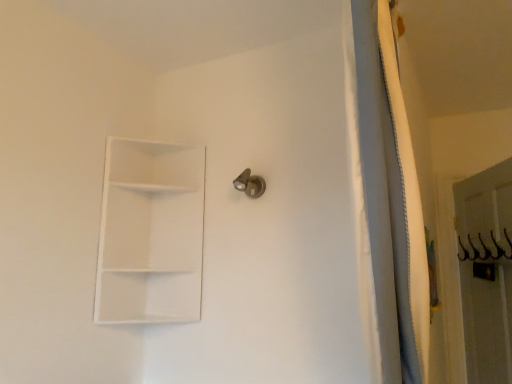
Locate an element on the screen. satin nickel door handle at upper center is located at coordinates (250, 184).

What do you see at coordinates (250, 184) in the screenshot? Image resolution: width=512 pixels, height=384 pixels. I see `satin nickel door handle at upper center` at bounding box center [250, 184].

The image size is (512, 384). I want to click on white matte shelf at upper left, so click(150, 233).

What do you see at coordinates (150, 233) in the screenshot?
I see `white matte shelf at upper left` at bounding box center [150, 233].

Locate an element on the screen. The image size is (512, 384). satin nickel door handle at upper center is located at coordinates (250, 184).

Is white matte shelf at upper left to the right of satin nickel door handle at upper center from the viewer's perspective?

Incorrect, white matte shelf at upper left is not on the right side of satin nickel door handle at upper center.

Is the position of white matte shelf at upper left more distant than that of satin nickel door handle at upper center?

No, the depth of white matte shelf at upper left is less than that of satin nickel door handle at upper center.

Does point (101, 235) lie in front of point (260, 183)?

Yes, it is in front of point (260, 183).

From the image's perspective, is white matte shelf at upper left located above or below satin nickel door handle at upper center?

white matte shelf at upper left is situated lower than satin nickel door handle at upper center in the image.

In the scene shown: From a real-world perspective, is white matte shelf at upper left positioned over satin nickel door handle at upper center based on gravity?

No, from a real-world perspective, white matte shelf at upper left is not over satin nickel door handle at upper center

Considering the sizes of objects white matte shelf at upper left and satin nickel door handle at upper center in the image provided, who is thinner, white matte shelf at upper left or satin nickel door handle at upper center?

satin nickel door handle at upper center.

From the picture: Can you confirm if white matte shelf at upper left is taller than satin nickel door handle at upper center?

Indeed, white matte shelf at upper left has a greater height compared to satin nickel door handle at upper center.

Does white matte shelf at upper left have a larger size compared to satin nickel door handle at upper center?

Indeed, white matte shelf at upper left has a larger size compared to satin nickel door handle at upper center.

Is satin nickel door handle at upper center a part of white matte shelf at upper left?

Actually, satin nickel door handle at upper center is outside white matte shelf at upper left.

In the scene shown: Is white matte shelf at upper left next to satin nickel door handle at upper center?

No, white matte shelf at upper left is not beside satin nickel door handle at upper center.

Is white matte shelf at upper left positioned with its back to satin nickel door handle at upper center?

That's not correct — white matte shelf at upper left is not looking away from satin nickel door handle at upper center.

How far apart are white matte shelf at upper left and satin nickel door handle at upper center?

A distance of 16.52 inches exists between white matte shelf at upper left and satin nickel door handle at upper center.

Identify the location of shelf lying below the satin nickel door handle at upper center (from the image's perspective). (150, 233).

Which is more to the left, satin nickel door handle at upper center or white matte shelf at upper left?

From the viewer's perspective, white matte shelf at upper left appears more on the left side.

Does satin nickel door handle at upper center come in front of white matte shelf at upper left?

No, satin nickel door handle at upper center is behind white matte shelf at upper left.

Based on the photo, which point is more distant from viewer, (234, 180) or (160, 191)?

The point (160, 191) is behind.

From the image's perspective, which one is positioned higher, satin nickel door handle at upper center or white matte shelf at upper left?

satin nickel door handle at upper center.

From a real-world perspective, which is physically below, satin nickel door handle at upper center or white matte shelf at upper left?

From a 3D spatial view, white matte shelf at upper left is below.

Considering the sizes of objects satin nickel door handle at upper center and white matte shelf at upper left in the image provided, who is thinner, satin nickel door handle at upper center or white matte shelf at upper left?

With smaller width is satin nickel door handle at upper center.

Which of these two, satin nickel door handle at upper center or white matte shelf at upper left, stands shorter?

Standing shorter between the two is satin nickel door handle at upper center.

Does satin nickel door handle at upper center have a larger size compared to white matte shelf at upper left?

No.

Is white matte shelf at upper left completely or partially inside satin nickel door handle at upper center?

No, white matte shelf at upper left is not surrounded by satin nickel door handle at upper center.

Is satin nickel door handle at upper center positioned far away from white matte shelf at upper left?

No, satin nickel door handle at upper center is not far from white matte shelf at upper left.

Is satin nickel door handle at upper center facing away from white matte shelf at upper left?

No, white matte shelf at upper left is not at the back of satin nickel door handle at upper center.

What's the angular difference between satin nickel door handle at upper center and white matte shelf at upper left's facing directions?

satin nickel door handle at upper center and white matte shelf at upper left are facing 0.00427 degrees away from each other.

How far apart are satin nickel door handle at upper center and white matte shelf at upper left?

A distance of 41.96 centimeters exists between satin nickel door handle at upper center and white matte shelf at upper left.

The image size is (512, 384). Find the location of `shelf in front of the satin nickel door handle at upper center`. shelf in front of the satin nickel door handle at upper center is located at coordinates (150, 233).

Locate an element on the screen. The width and height of the screenshot is (512, 384). door handle on the right of white matte shelf at upper left is located at coordinates (250, 184).

You are a GUI agent. You are given a task and a screenshot of the screen. Output one action in this format:
    pyautogui.click(x=<x>, y=<y>)
    Task: Click on the shelf on the left of satin nickel door handle at upper center
    
    Given the screenshot: What is the action you would take?
    pyautogui.click(x=150, y=233)